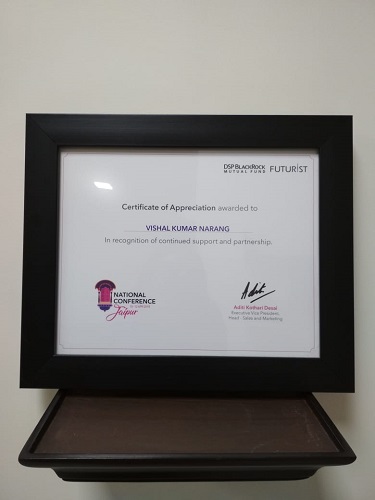
You are a GUI agent. You are given a task and a screenshot of the screen. Output one action in this format:
    pyautogui.click(x=<x>, y=<y>)
    Task: Click on the shelf
    The width and height of the screenshot is (375, 500).
    Given the screenshot: What is the action you would take?
    pyautogui.click(x=240, y=429)